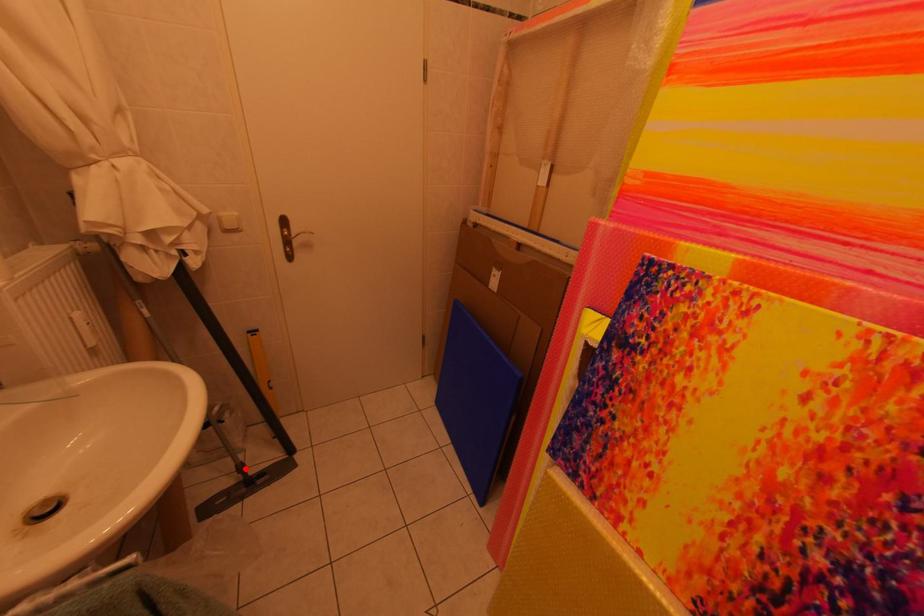
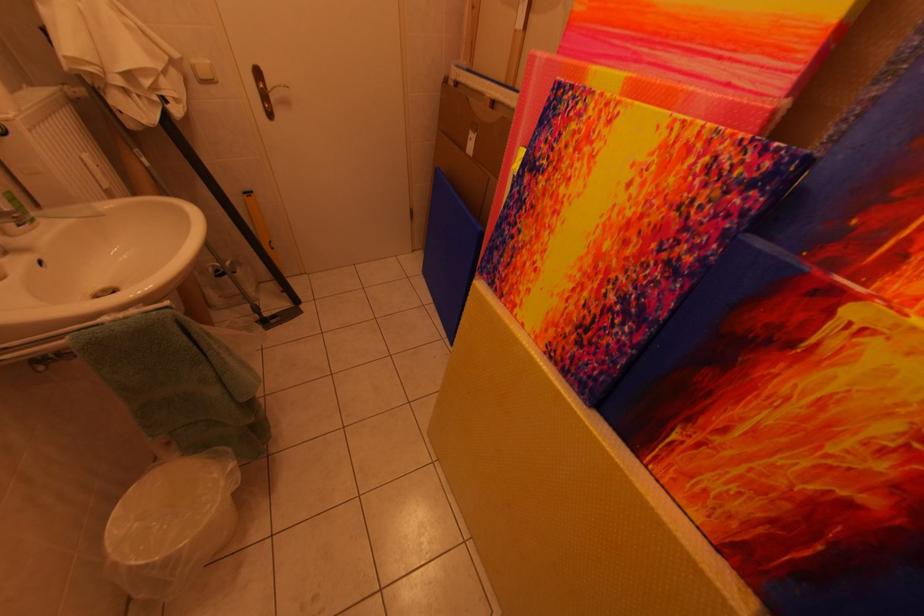
Where in the second image is the point corresponding to the highlighted location from the first image?

(261, 310)